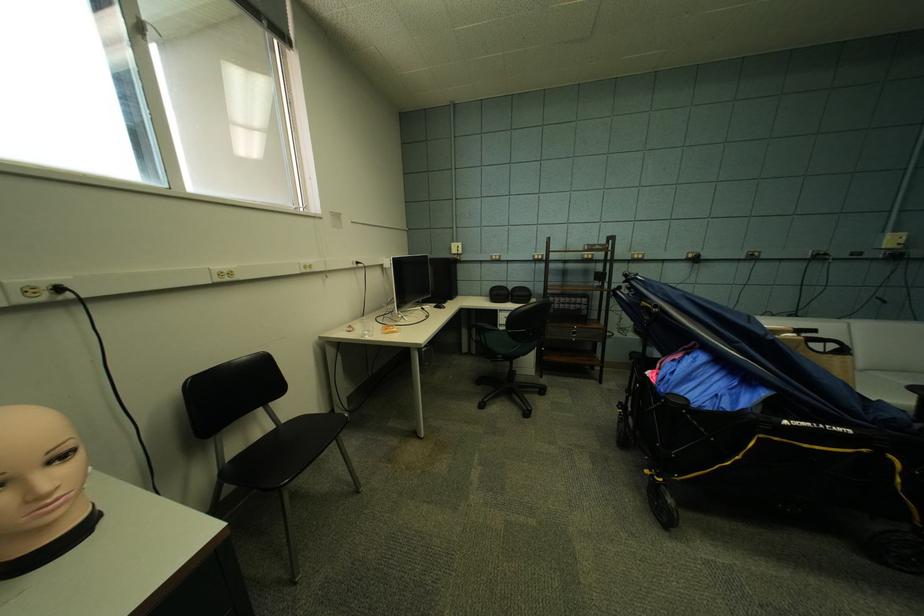
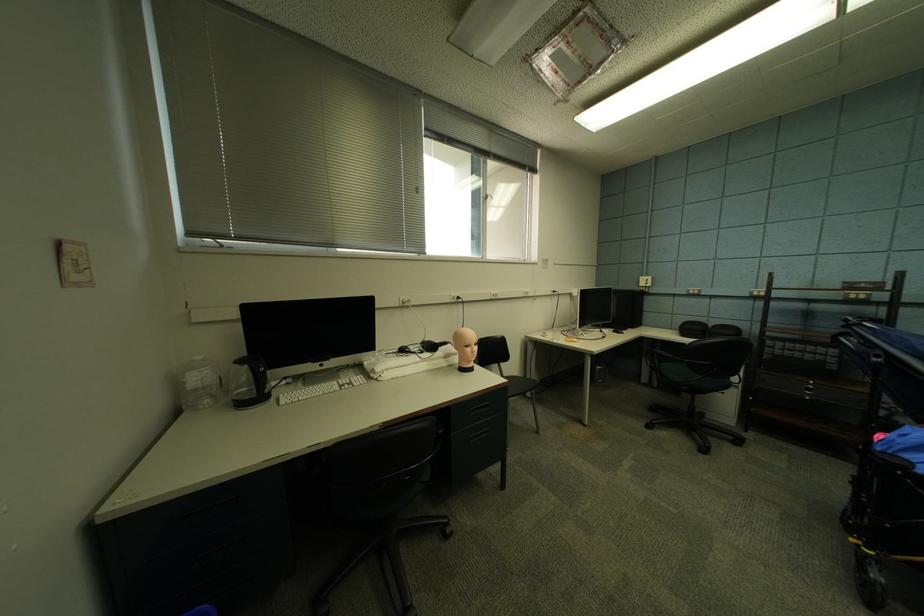
Where in the second image is the point corresponding to [363,267] from the first image?

(561, 294)